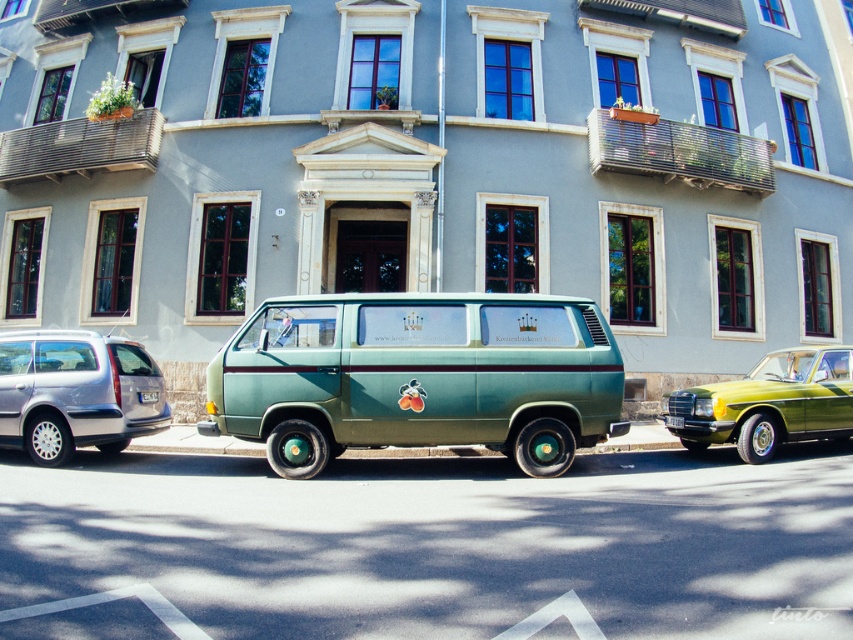
Question: Which object is positioned closest to the green matte van at center?

Choices:
 (A) satin silver minivan at left
 (B) metallic green sedan at right

Answer: (A)

Question: Estimate the real-world distances between objects in this image. Which object is closer to the green matte license plate at center?

Choices:
 (A) metallic green sedan at right
 (B) satin silver minivan at left
 (C) green matte van at center

Answer: (B)

Question: Is green matte van at center positioned behind satin silver minivan at left?

Choices:
 (A) yes
 (B) no

Answer: (B)

Question: Which point is closer to the camera?

Choices:
 (A) green matte van at center
 (B) metallic green sedan at right
 (C) green matte license plate at center
 (D) satin silver minivan at left

Answer: (A)

Question: Can you confirm if green matte van at center is thinner than metallic green sedan at right?

Choices:
 (A) yes
 (B) no

Answer: (B)

Question: Observing the image, what is the correct spatial positioning of green matte van at center in reference to green matte license plate at center?

Choices:
 (A) right
 (B) left

Answer: (A)